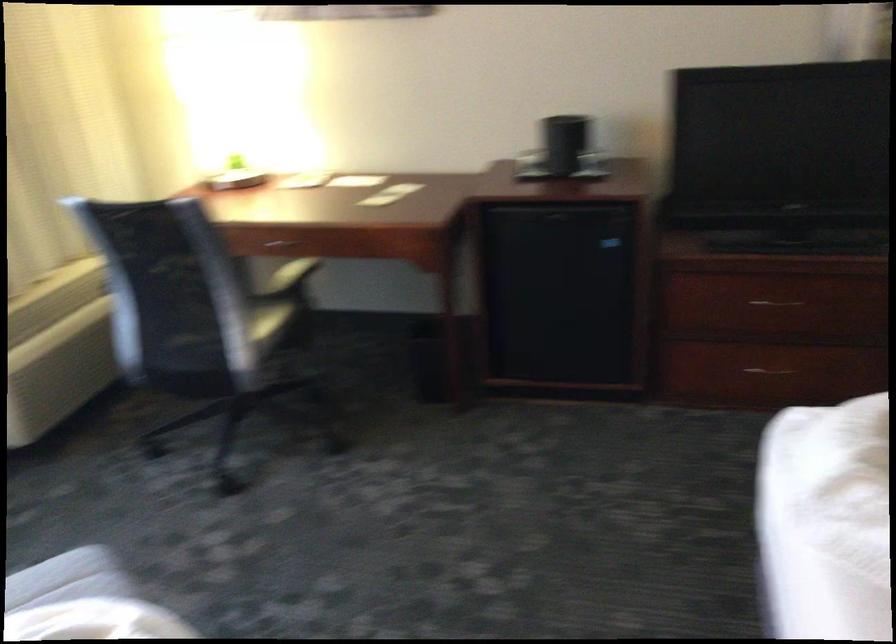
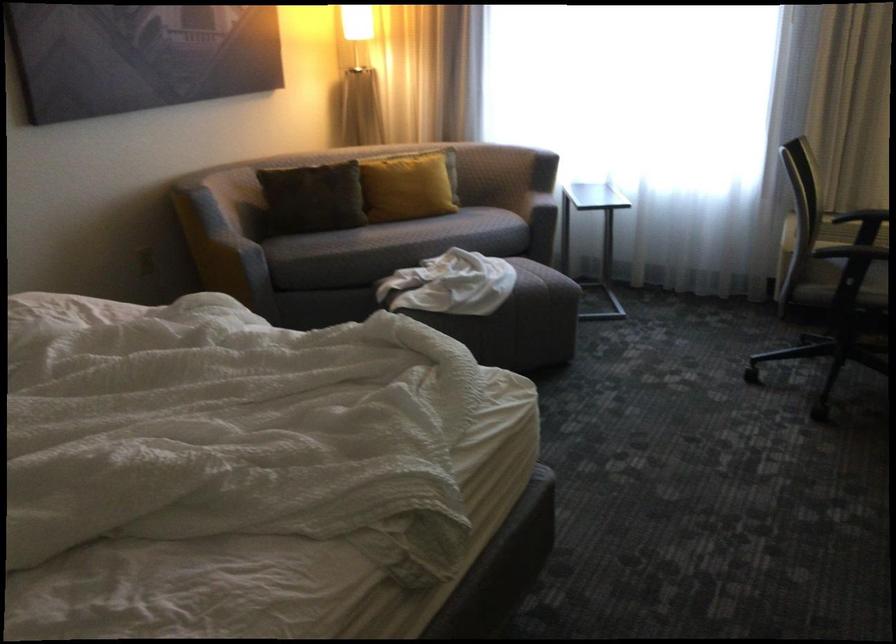
In the second image, find the point that corresponds to [237,341] in the first image.

(831, 294)